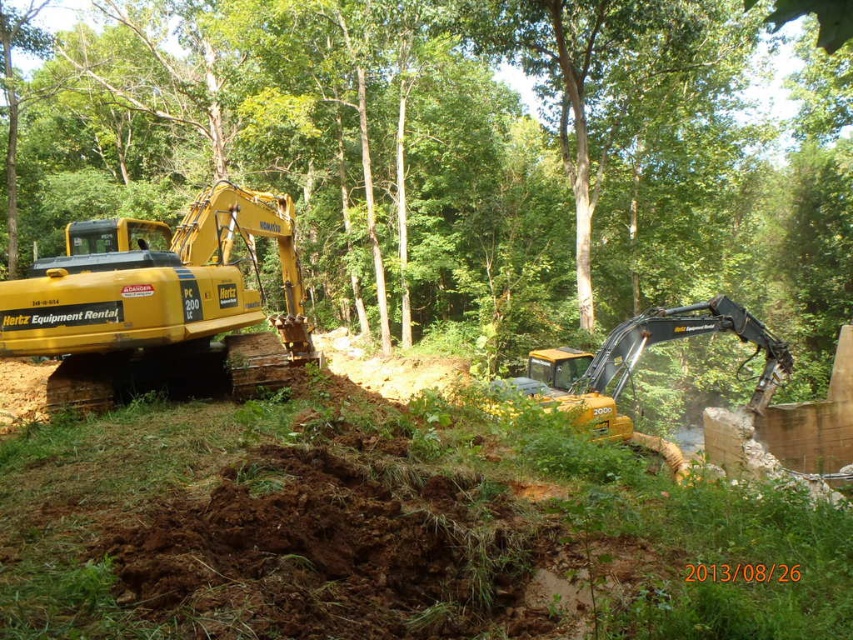
Is yellow metallic excavator at left taller than yellow rubber excavator at center?

Correct, yellow metallic excavator at left is much taller as yellow rubber excavator at center.

Can you confirm if yellow metallic excavator at left is positioned below yellow rubber excavator at center?

No.

Measure the distance between point (219,202) and camera.

Point (219,202) and camera are 12.37 meters apart.

This screenshot has height=640, width=853. I want to click on yellow metallic excavator at left, so click(158, 298).

Can you confirm if green leafy tree at upper center is positioned to the right of yellow rubber excavator at center?

In fact, green leafy tree at upper center is to the left of yellow rubber excavator at center.

Can you confirm if green leafy tree at upper center is positioned above yellow rubber excavator at center?

Correct, green leafy tree at upper center is located above yellow rubber excavator at center.

The image size is (853, 640). Find the location of `green leafy tree at upper center`. green leafy tree at upper center is located at coordinates click(444, 164).

Is point (778, 234) positioned before point (299, 304)?

No.

Is green leafy tree at upper center further to camera compared to yellow metallic excavator at left?

That is False.

What are the coordinates of `green leafy tree at upper center` in the screenshot? It's located at (444, 164).